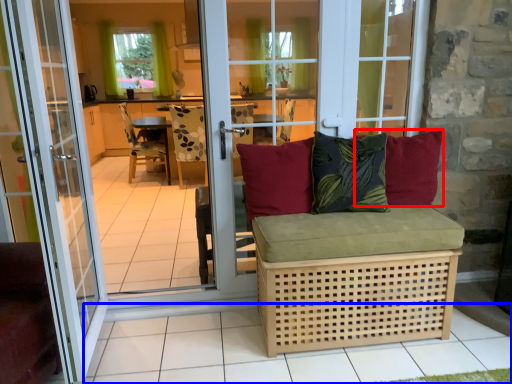
Question: Which point is further to the camera, pillow (highlighted by a red box) or tile (highlighted by a blue box)?

Choices:
 (A) pillow
 (B) tile

Answer: (A)